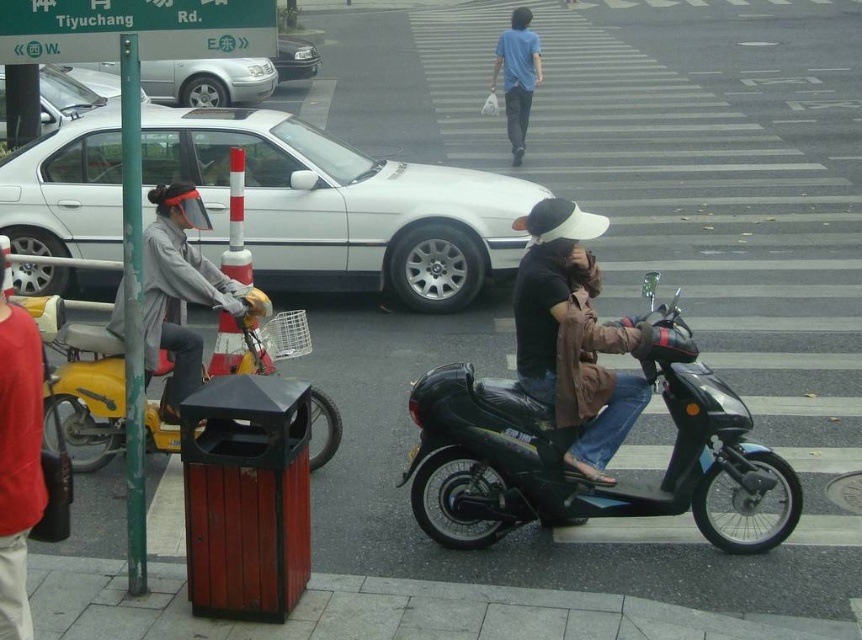
Question: Is white matte sedan at center below white glossy sedan at center?

Choices:
 (A) no
 (B) yes

Answer: (B)

Question: Does red sweater at left appear under dark brown leather jacket at center?

Choices:
 (A) yes
 (B) no

Answer: (A)

Question: Which object is the closest to the white glossy sedan at center?

Choices:
 (A) shiny silver sedan at center
 (B) green plastic street sign at upper left
 (C) gray fabric jacket at left

Answer: (A)

Question: Which object appears farthest from the camera in this image?

Choices:
 (A) white glossy sedan at center
 (B) black matte motorcycle at center
 (C) white matte sedan at center

Answer: (A)

Question: Can you confirm if yellow matte motorcycle at left is positioned to the right of brown leather jacket at center?

Choices:
 (A) yes
 (B) no

Answer: (B)

Question: Which object is the closest to the red sweater at left?

Choices:
 (A) green plastic street sign at upper left
 (B) silver metallic sedan at upper left
 (C) blue cotton shirt at center
 (D) black matte motorcycle at center

Answer: (A)